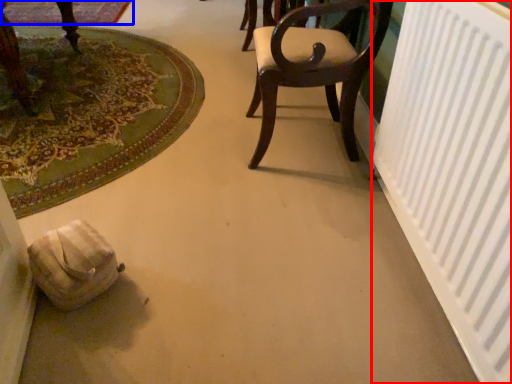
Question: Which of the following is the closest to the observer, radiator (highlighted by a red box) or mat (highlighted by a blue box)?

Choices:
 (A) radiator
 (B) mat

Answer: (A)